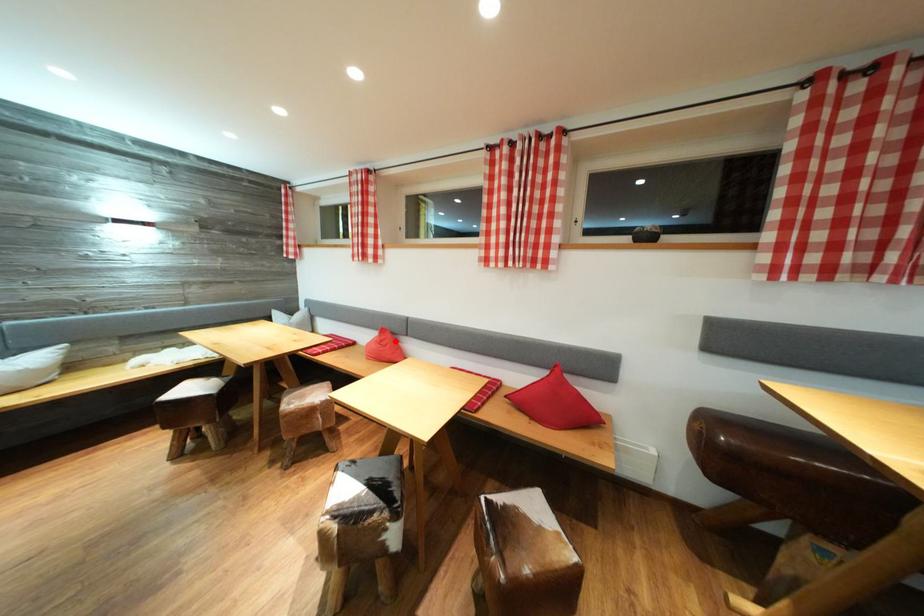
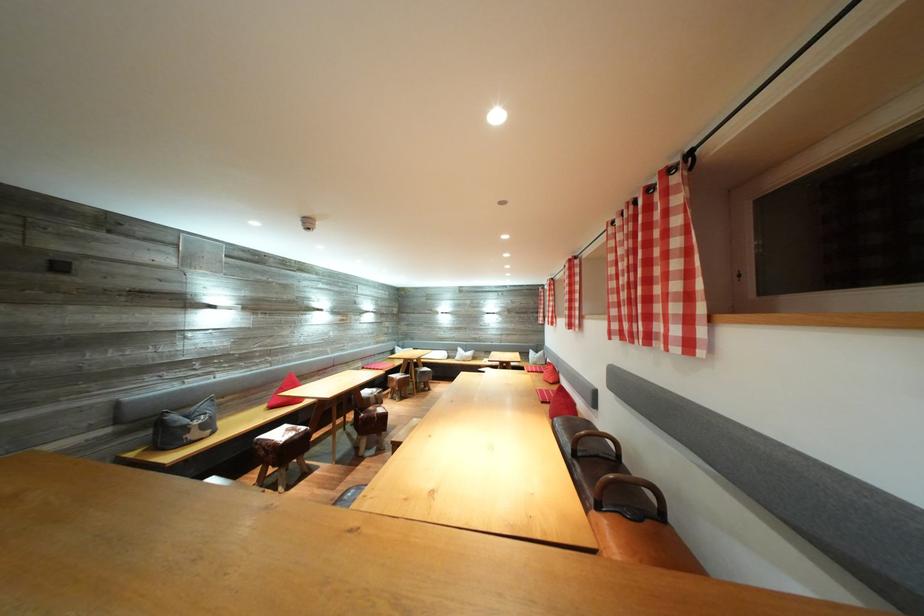
Question: I am providing you with two images of the same scene from different viewpoints. A red point is shown in image1. For the corresponding object point in image2, is it positioned nearer or farther from the camera?

Choices:
 (A) Nearer
 (B) Farther

Answer: (A)